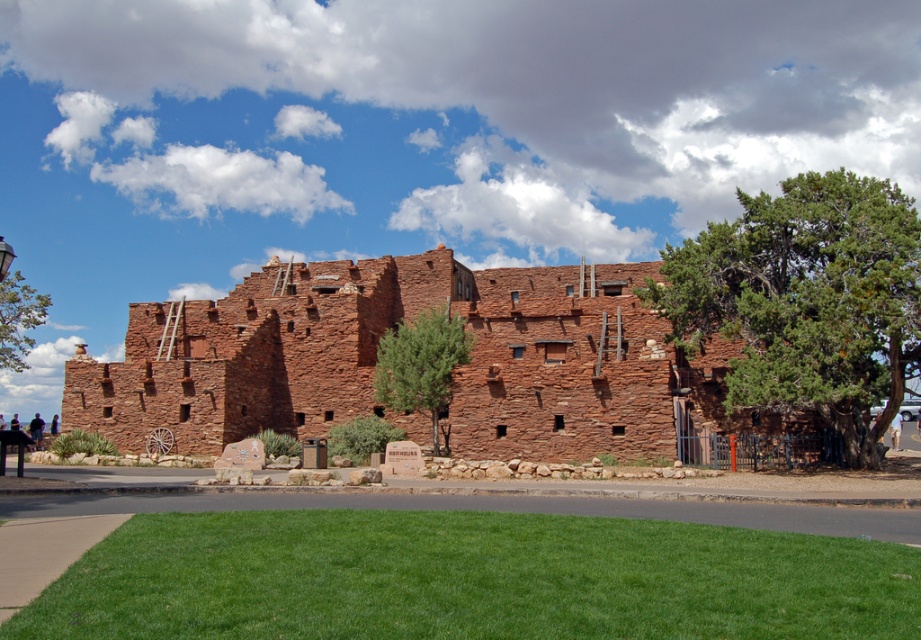
Question: Is green textured tree at right bigger than light brown wooden sign at center?

Choices:
 (A) no
 (B) yes

Answer: (B)

Question: Which object appears farthest from the camera in this image?

Choices:
 (A) light brown shorts at lower right
 (B) dark blue fabric at center
 (C) green asphalt at lower center
 (D) light brown wooden sign at center

Answer: (D)

Question: Is reddish-brown stone ruins at center smaller than green leafy tree at left?

Choices:
 (A) no
 (B) yes

Answer: (B)

Question: Among these points, which one is farthest from the camera?

Choices:
 (A) (865, 200)
 (B) (405, 364)
 (C) (44, 508)
 (D) (391, 410)

Answer: (D)

Question: Which object appears farthest from the camera in this image?

Choices:
 (A) green textured tree at center
 (B) green textured tree at right
 (C) dark blue fabric at center
 (D) light brown wooden sign at center

Answer: (D)

Question: Can you confirm if green leafy tree at left is positioned below dark brown leather jacket at lower left?

Choices:
 (A) no
 (B) yes

Answer: (A)